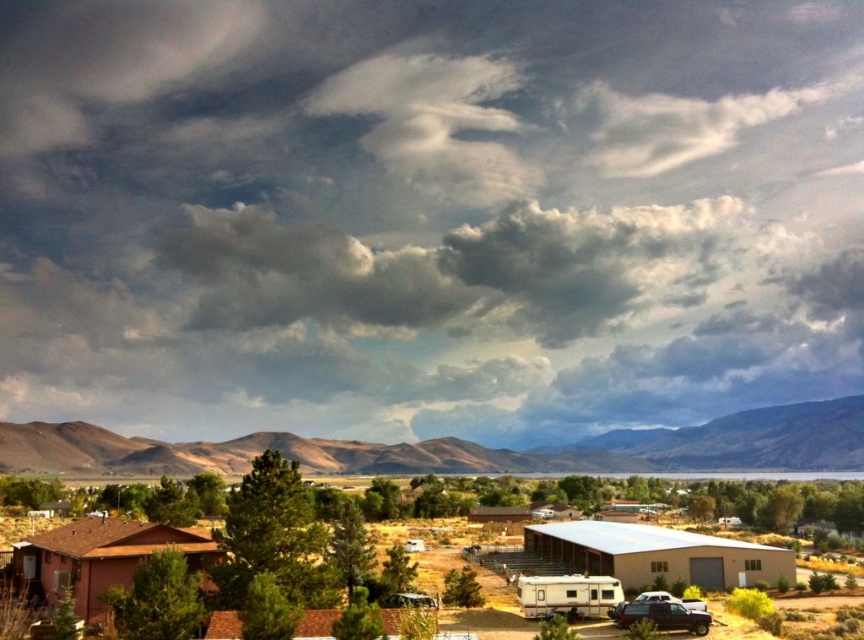
From the picture: Does cloudy sky at upper center come behind white plastic trailer at center?

Yes, cloudy sky at upper center is behind white plastic trailer at center.

Find the location of a particular element. The height and width of the screenshot is (640, 864). cloudy sky at upper center is located at coordinates (427, 212).

At what (x,y) coordinates should I click in order to perform the action: click on cloudy sky at upper center. Please return your answer as a coordinate pair (x, y). Looking at the image, I should click on (427, 212).

From the picture: Does brown/dry soil at center have a greater height compared to metallic silver car at center?

Yes, brown/dry soil at center is taller than metallic silver car at center.

Is brown/dry soil at center above metallic silver car at center?

No, brown/dry soil at center is not above metallic silver car at center.

This screenshot has height=640, width=864. What do you see at coordinates (469, 449) in the screenshot?
I see `brown/dry soil at center` at bounding box center [469, 449].

Image resolution: width=864 pixels, height=640 pixels. Find the location of `brown/dry soil at center`. brown/dry soil at center is located at coordinates (469, 449).

At what (x,y) coordinates should I click in order to perform the action: click on white matte recreational vehicle at center. Please return your answer as a coordinate pair (x, y). Looking at the image, I should click on (567, 595).

Does white matte recreational vehicle at center have a lesser width compared to shiny black suv at lower right?

In fact, white matte recreational vehicle at center might be wider than shiny black suv at lower right.

Between point (558, 584) and point (671, 605), which one is positioned in front?

Positioned in front is point (671, 605).

You are a GUI agent. You are given a task and a screenshot of the screen. Output one action in this format:
    pyautogui.click(x=<x>, y=<y>)
    Task: Click on the white matte recreational vehicle at center
    
    Given the screenshot: What is the action you would take?
    pyautogui.click(x=567, y=595)